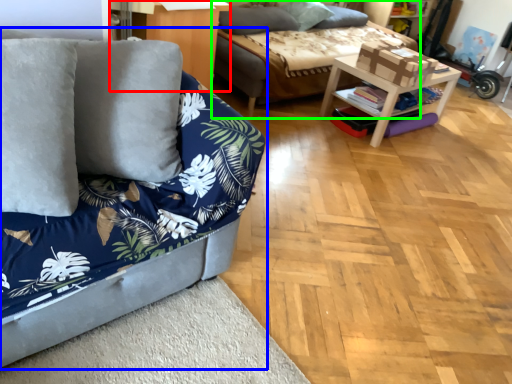
Question: Which is nearer to the dresser (highlighted by a red box)? studio couch (highlighted by a blue box) or studio couch (highlighted by a green box).

Choices:
 (A) studio couch
 (B) studio couch

Answer: (B)